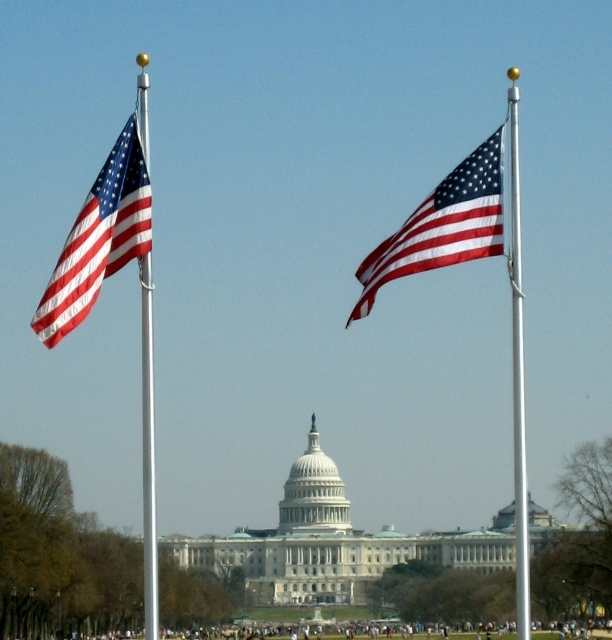
Does shiny metallic flag at center have a lesser height compared to polished silver flag pole at left?

Yes.

Is shiny metallic flag at center behind polished silver flag pole at left?

A: Yes, it is.

Who is more forward, (452, 202) or (147, 385)?

Point (452, 202) is in front.

Image resolution: width=612 pixels, height=640 pixels. I want to click on shiny metallic flag at center, so click(x=442, y=225).

Is point (100, 179) positioned after point (411, 243)?

That is False.

Does matte fabric flag at left have a lesser height compared to shiny metallic flag at center?

Yes, matte fabric flag at left is shorter than shiny metallic flag at center.

Where is `matte fabric flag at left`? matte fabric flag at left is located at coordinates (99, 237).

Which is more to the left, silver metallic flag pole at right or polished silver flag pole at left?

polished silver flag pole at left is more to the left.

Measure the distance between silver metallic flag pole at right and polished silver flag pole at left.

silver metallic flag pole at right is 48.66 meters from polished silver flag pole at left.

Does point (515, 100) lie in front of point (144, 282)?

No, (515, 100) is further to viewer.

Where is `silver metallic flag pole at right`? silver metallic flag pole at right is located at coordinates (517, 374).